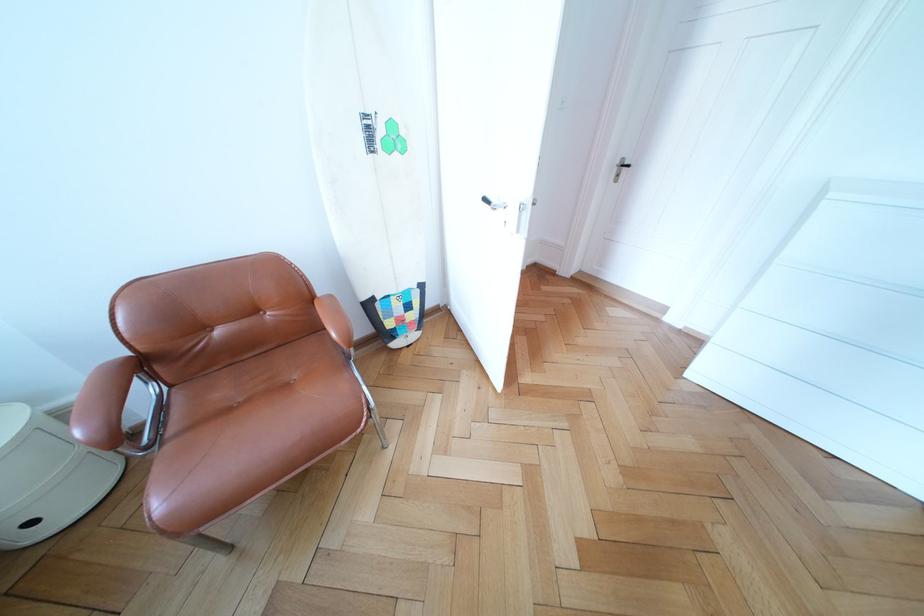
Find where to rest the brown chair armrest. Please return your answer as a coordinate pair (x, y).

(63, 411)